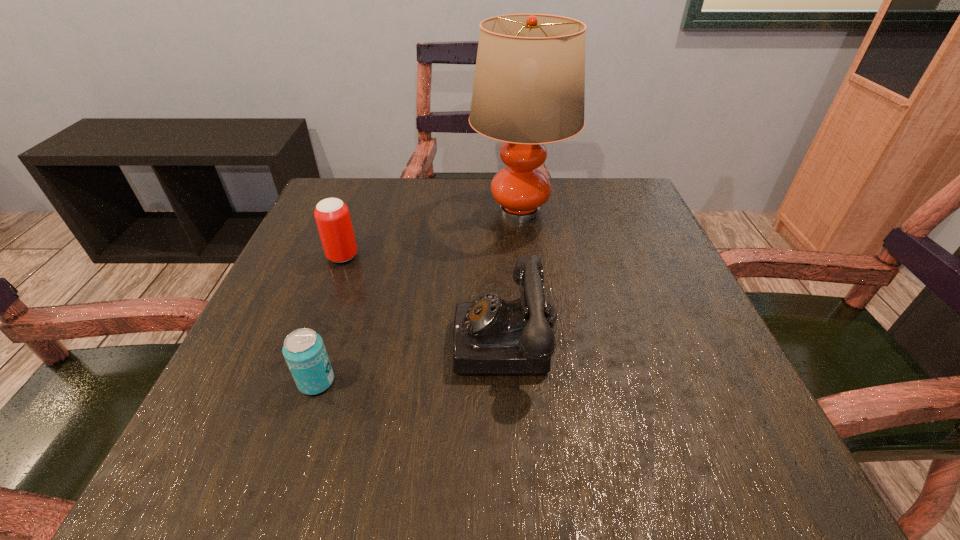
This screenshot has width=960, height=540. In the image, there is a desktop. What are the coordinates of `vacant region at the near right corner` in the screenshot? It's located at (676, 472).

This screenshot has height=540, width=960. Identify the location of unoccupied area between the farthest object and the shorter beer can. coord(419,296).

This screenshot has width=960, height=540. Find the location of `vacant point located between the telephone and the taller beer can`. vacant point located between the telephone and the taller beer can is located at coordinates (425, 298).

Locate an element on the screen. vacant space that is in between the second farthest object and the shortest object is located at coordinates (329, 319).

The image size is (960, 540). In order to click on vacant area that lies between the telephone and the nearer beer can in this screenshot , I will do `click(412, 361)`.

What are the coordinates of `free spot between the farthest object and the shorter beer can` in the screenshot? It's located at (419, 296).

At what (x,y) coordinates should I click in order to perform the action: click on empty space between the farther beer can and the shortest object. Please return your answer as a coordinate pair (x, y). This screenshot has width=960, height=540. Looking at the image, I should click on (329, 319).

Locate an element on the screen. This screenshot has height=540, width=960. free space that is in between the taller beer can and the lamp is located at coordinates (431, 234).

Where is `free space between the third nearest object and the nearer beer can`? The width and height of the screenshot is (960, 540). free space between the third nearest object and the nearer beer can is located at coordinates (329, 319).

Locate which object ranks third in proximity to the farthest object. Please provide its 2D coordinates. Your answer should be formatted as a tuple, i.e. [(x, y)], where the tuple contains the x and y coordinates of a point satisfying the conditions above.

[(304, 351)]